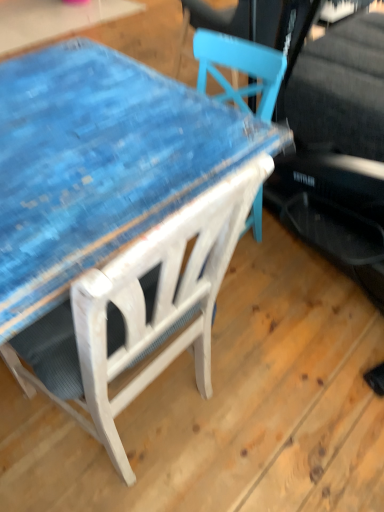
In order to face blue painted wood table at center, should I rotate leftwards or rightwards?

You should rotate right by 1.530 degrees.

Find the location of a particular element. blue painted wood table at center is located at coordinates (99, 164).

What do you see at coordinates (99, 164) in the screenshot? I see `blue painted wood table at center` at bounding box center [99, 164].

Measure the distance between white wood chair at upper center and camera.

white wood chair at upper center and camera are 19.59 inches apart from each other.

The image size is (384, 512). What do you see at coordinates (154, 307) in the screenshot?
I see `white wood chair at upper center` at bounding box center [154, 307].

The image size is (384, 512). I want to click on white wood chair at upper center, so click(154, 307).

What are the coordinates of `blue painted wood table at center` in the screenshot? It's located at (99, 164).

Between blue painted wood table at center and white wood chair at upper center, which one appears on the right side from the viewer's perspective?

From the viewer's perspective, blue painted wood table at center appears more on the right side.

Which object is more forward, blue painted wood table at center or white wood chair at upper center?

white wood chair at upper center is more forward.

Which point is more forward, (87, 109) or (235, 195)?

The point (235, 195) is in front.

From the image's perspective, which is below, blue painted wood table at center or white wood chair at upper center?

white wood chair at upper center, from the image's perspective.

From a real-world perspective, which object stands above the other?

white wood chair at upper center.

Considering the sizes of objects blue painted wood table at center and white wood chair at upper center in the image provided, who is wider, blue painted wood table at center or white wood chair at upper center?

Wider between the two is white wood chair at upper center.

Considering the relative sizes of blue painted wood table at center and white wood chair at upper center in the image provided, is blue painted wood table at center taller than white wood chair at upper center?

No.

Which of these two, blue painted wood table at center or white wood chair at upper center, is bigger?

white wood chair at upper center is bigger.

Is white wood chair at upper center inside blue painted wood table at center?

That's incorrect, white wood chair at upper center is not inside blue painted wood table at center.

Does blue painted wood table at center touch white wood chair at upper center?

No, blue painted wood table at center is not in contact with white wood chair at upper center.

Could you tell me if blue painted wood table at center is facing white wood chair at upper center?

Yes, blue painted wood table at center is oriented towards white wood chair at upper center.

At what (x,y) coordinates should I click in order to perform the action: click on table below the white wood chair at upper center (from a real-world perspective). Please return your answer as a coordinate pair (x, y). The height and width of the screenshot is (512, 384). Looking at the image, I should click on (99, 164).

Considering the positions of objects white wood chair at upper center and blue painted wood table at center in the image provided, who is more to the right, white wood chair at upper center or blue painted wood table at center?

Positioned to the right is blue painted wood table at center.

Does white wood chair at upper center lie in front of blue painted wood table at center?

Yes, it is in front of blue painted wood table at center.

Does point (237, 214) lie behind point (124, 170)?

No.

Based on the photo, from the image's perspective, is white wood chair at upper center over blue painted wood table at center?

No, from the image's perspective, white wood chair at upper center is not over blue painted wood table at center.

From a real-world perspective, who is located higher, white wood chair at upper center or blue painted wood table at center?

white wood chair at upper center.

In terms of width, does white wood chair at upper center look wider or thinner when compared to blue painted wood table at center?

Clearly, white wood chair at upper center has more width compared to blue painted wood table at center.

Does white wood chair at upper center have a greater height compared to blue painted wood table at center?

Indeed, white wood chair at upper center has a greater height compared to blue painted wood table at center.

Considering the sizes of objects white wood chair at upper center and blue painted wood table at center in the image provided, who is smaller, white wood chair at upper center or blue painted wood table at center?

blue painted wood table at center.

Choose the correct answer: Is white wood chair at upper center inside blue painted wood table at center or outside it?

white wood chair at upper center lies outside blue painted wood table at center.

Is white wood chair at upper center next to blue painted wood table at center and touching it?

No.

Could you tell me if white wood chair at upper center is facing blue painted wood table at center?

No, white wood chair at upper center is not oriented towards blue painted wood table at center.

How different are the orientations of white wood chair at upper center and blue painted wood table at center in degrees?

The angle between the facing direction of white wood chair at upper center and the facing direction of blue painted wood table at center is 92.3 degrees.

Locate an element on the screen. The width and height of the screenshot is (384, 512). chair in front of the blue painted wood table at center is located at coordinates (154, 307).

You are a GUI agent. You are given a task and a screenshot of the screen. Output one action in this format:
    pyautogui.click(x=<x>, y=<y>)
    Task: Click on the chair on the left of blue painted wood table at center
    
    Given the screenshot: What is the action you would take?
    pyautogui.click(x=154, y=307)

In order to click on table that is above the white wood chair at upper center (from the image's perspective) in this screenshot , I will do `click(99, 164)`.